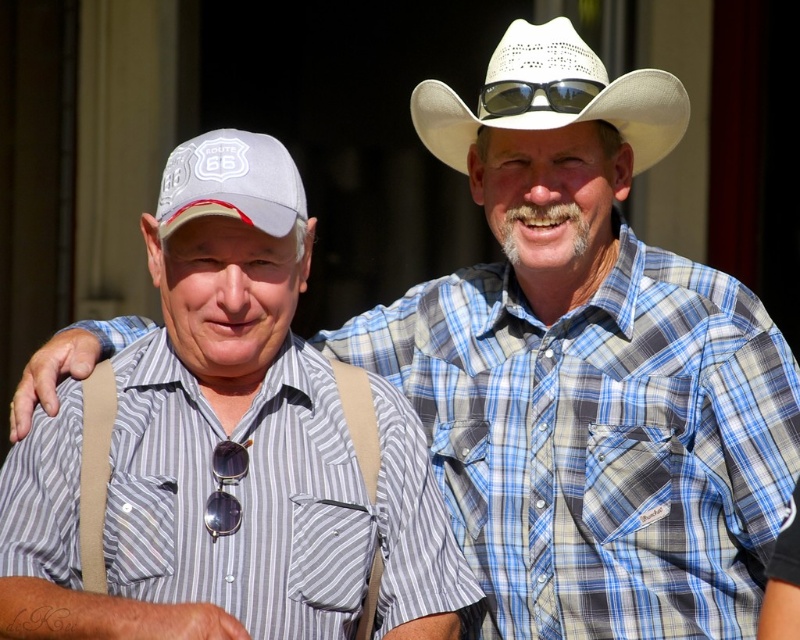
Question: Does striped cotton shirt at center appear on the right side of white fabric baseball cap at left?

Choices:
 (A) yes
 (B) no

Answer: (B)

Question: Where is striped cotton shirt at center located in relation to white woven cowboy hat at upper center in the image?

Choices:
 (A) below
 (B) above

Answer: (A)

Question: Which object is farther from the camera taking this photo?

Choices:
 (A) sunglasses at center
 (B) striped cotton shirt at center

Answer: (A)

Question: Which point appears farthest from the camera in this image?

Choices:
 (A) (184, 212)
 (B) (572, 122)

Answer: (B)

Question: Which point is closer to the camera?

Choices:
 (A) white woven cowboy hat at upper center
 (B) white fabric baseball cap at left
 (C) sunglasses at center

Answer: (B)

Question: Does striped cotton shirt at center appear on the right side of sunglasses at center?

Choices:
 (A) yes
 (B) no

Answer: (B)